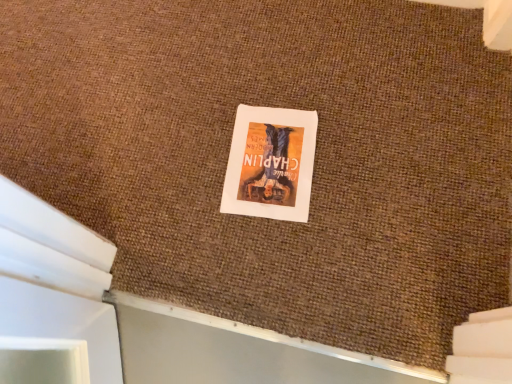
The width and height of the screenshot is (512, 384). I want to click on vacant area on top of matte paper poster at center (from a real-world perspective), so click(271, 156).